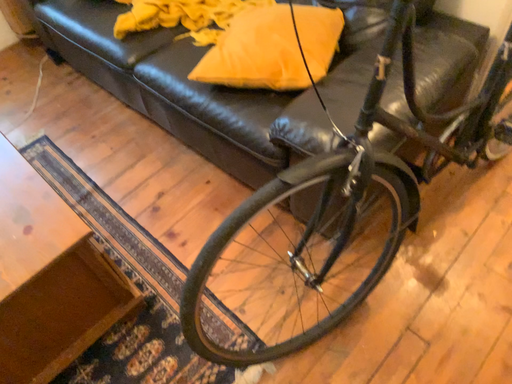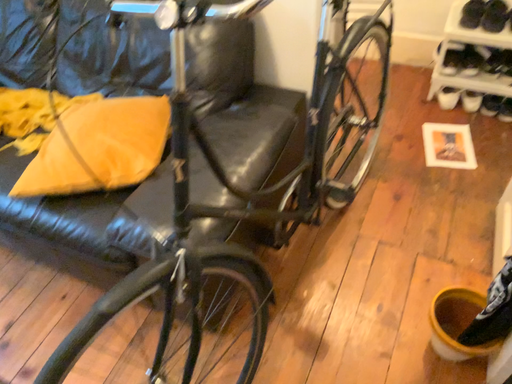
Question: Which way did the camera rotate in the video?

Choices:
 (A) rotated right
 (B) rotated left

Answer: (A)